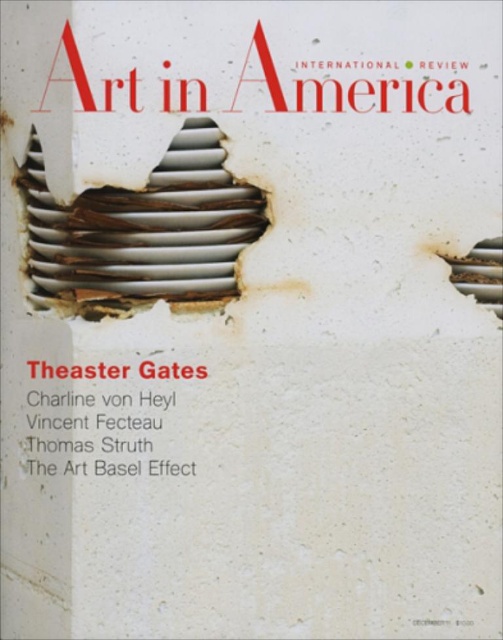
Question: Does white matte text at center have a lesser width compared to rusty metal hole at center right?

Choices:
 (A) yes
 (B) no

Answer: (B)

Question: Does rusty metal spiral at center appear under rusty metal hole at center right?

Choices:
 (A) no
 (B) yes

Answer: (A)

Question: From the image, what is the correct spatial relationship of white matte text at center in relation to rusty metal hole at center right?

Choices:
 (A) left
 (B) right

Answer: (A)

Question: Which point is farther from the camera taking this photo?

Choices:
 (A) (82, 211)
 (B) (501, 259)
 (C) (105, 364)

Answer: (B)

Question: Which object is farther from the camera taking this photo?

Choices:
 (A) rusty metal spiral at center
 (B) white matte text at center
 (C) rusty metal hole at center right

Answer: (C)

Question: Which of the following is the closest to the observer?

Choices:
 (A) white matte text at center
 (B) rusty metal spiral at center

Answer: (A)